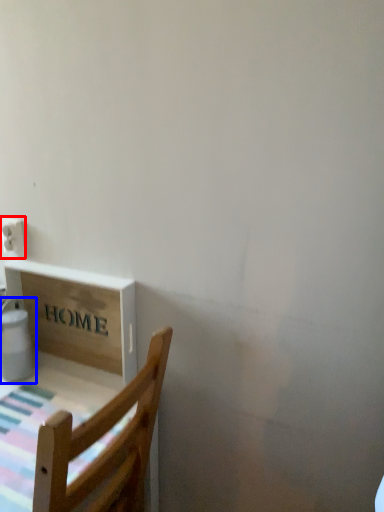
Question: Among these objects, which one is farthest to the camera, electric outlet (highlighted by a red box) or water heater (highlighted by a blue box)?

Choices:
 (A) electric outlet
 (B) water heater

Answer: (A)